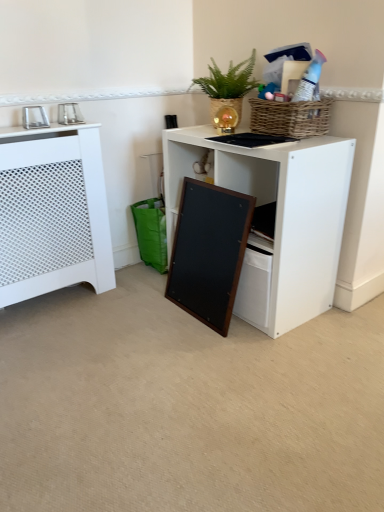
Find the location of a particular element. The height and width of the screenshot is (512, 384). space that is in front of white matte desk at center is located at coordinates point(247,368).